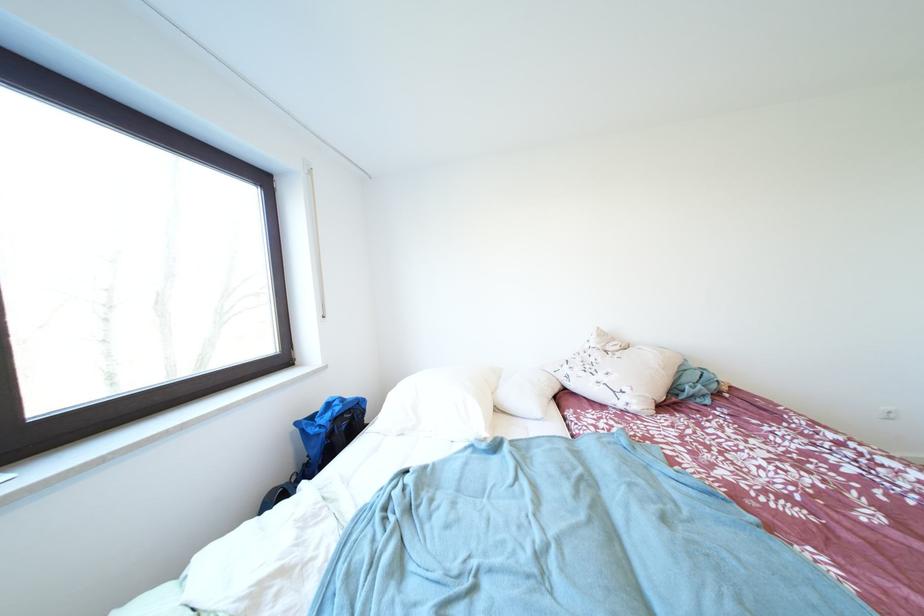
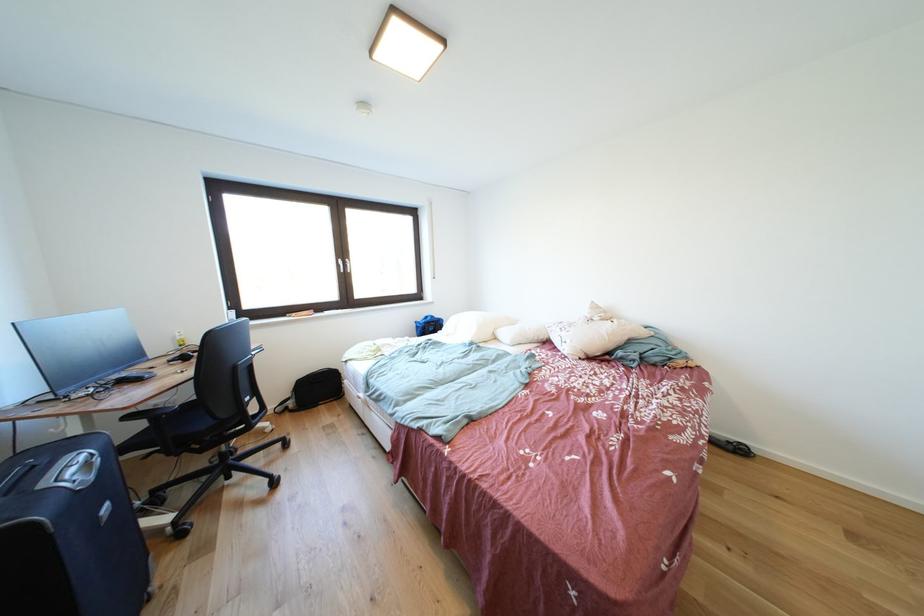
Find the pixel in the second image that matches (610,382) in the first image.

(572, 338)